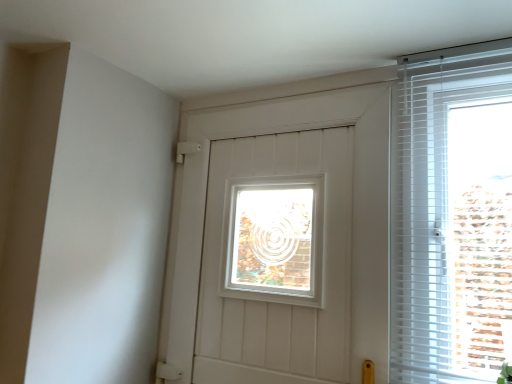
This screenshot has height=384, width=512. What are the coordinates of `white plastic blinds at right` in the screenshot? It's located at (440, 219).

Measure the distance between white plastic blinds at right and camera.

white plastic blinds at right is 3.51 feet from camera.

The width and height of the screenshot is (512, 384). What do you see at coordinates (440, 219) in the screenshot?
I see `white plastic blinds at right` at bounding box center [440, 219].

Find the location of a particular element. This screenshot has height=384, width=512. white matte door at center is located at coordinates (285, 131).

What do you see at coordinates (285, 131) in the screenshot? I see `white matte door at center` at bounding box center [285, 131].

You are a GUI agent. You are given a task and a screenshot of the screen. Output one action in this format:
    pyautogui.click(x=<x>, y=<y>)
    Task: Click on the white plastic blinds at right
    The height and width of the screenshot is (384, 512).
    Given the screenshot: What is the action you would take?
    pyautogui.click(x=440, y=219)

Which is more to the left, white plastic blinds at right or white matte door at center?

white matte door at center is more to the left.

Considering the positions of objects white plastic blinds at right and white matte door at center in the image provided, who is in front, white plastic blinds at right or white matte door at center?

Positioned in front is white plastic blinds at right.

Which point is more distant from viewer, (483, 377) or (229, 134)?

Positioned behind is point (229, 134).

From the image's perspective, between white plastic blinds at right and white matte door at center, who is located below?

white matte door at center appears lower in the image.

From a real-world perspective, is white plastic blinds at right positioned above or below white matte door at center?

white plastic blinds at right is above white matte door at center.

Considering the sizes of white plastic blinds at right and white matte door at center in the image, is white plastic blinds at right wider or thinner than white matte door at center?

Considering their sizes, white plastic blinds at right looks slimmer than white matte door at center.

Can you confirm if white plastic blinds at right is taller than white matte door at center?

In fact, white plastic blinds at right may be shorter than white matte door at center.

Is white plastic blinds at right bigger or smaller than white matte door at center?

Clearly, white plastic blinds at right is smaller in size than white matte door at center.

Is white plastic blinds at right spatially inside white matte door at center, or outside of it?

white plastic blinds at right is outside white matte door at center.

Is white plastic blinds at right not near white matte door at center?

white plastic blinds at right is near white matte door at center, not far away.

Is white plastic blinds at right looking in the opposite direction of white matte door at center?

white plastic blinds at right does not have its back to white matte door at center.

At what (x,y) coordinates should I click in order to perform the action: click on window in front of the white matte door at center. Please return your answer as a coordinate pair (x, y). Looking at the image, I should click on (440, 219).

Considering the positions of objects white matte door at center and white plastic blinds at right in the image provided, who is more to the right, white matte door at center or white plastic blinds at right?

white plastic blinds at right is more to the right.

Considering the positions of objects white matte door at center and white plastic blinds at right in the image provided, who is behind, white matte door at center or white plastic blinds at right?

Positioned behind is white matte door at center.

Does point (177, 276) come farther from viewer compared to point (438, 348)?

That is True.

From the image's perspective, which object appears higher, white matte door at center or white plastic blinds at right?

white plastic blinds at right appears higher in the image.

From a real-world perspective, is white matte door at center positioned over white plastic blinds at right based on gravity?

Actually, white matte door at center is physically below white plastic blinds at right in the real world.

Looking at their sizes, would you say white matte door at center is wider or thinner than white plastic blinds at right?

white matte door at center is wider than white plastic blinds at right.

Considering the sizes of objects white matte door at center and white plastic blinds at right in the image provided, who is shorter, white matte door at center or white plastic blinds at right?

With less height is white plastic blinds at right.

In the scene shown: Considering the sizes of objects white matte door at center and white plastic blinds at right in the image provided, who is bigger, white matte door at center or white plastic blinds at right?

Bigger between the two is white matte door at center.

Is white matte door at center situated inside white plastic blinds at right or outside?

white matte door at center is outside white plastic blinds at right.

Is white matte door at center next to white plastic blinds at right?

No, white matte door at center is not touching white plastic blinds at right.

Is white matte door at center oriented towards white plastic blinds at right?

No, white matte door at center is not oriented towards white plastic blinds at right.

From the picture: Can you tell me how much white matte door at center and white plastic blinds at right differ in facing direction?

They differ by 0.0401 degrees in their facing directions.

Identify the location of window in front of the white matte door at center. (440, 219).

This screenshot has width=512, height=384. I want to click on window on the right of the white matte door at center, so coord(440,219).

Where is `door behind the white plastic blinds at right`? Image resolution: width=512 pixels, height=384 pixels. door behind the white plastic blinds at right is located at coordinates (285, 131).